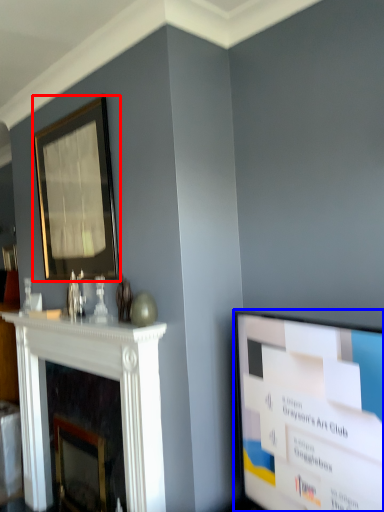
Question: Among these objects, which one is farthest to the camera, picture frame (highlighted by a red box) or television (highlighted by a blue box)?

Choices:
 (A) picture frame
 (B) television

Answer: (A)